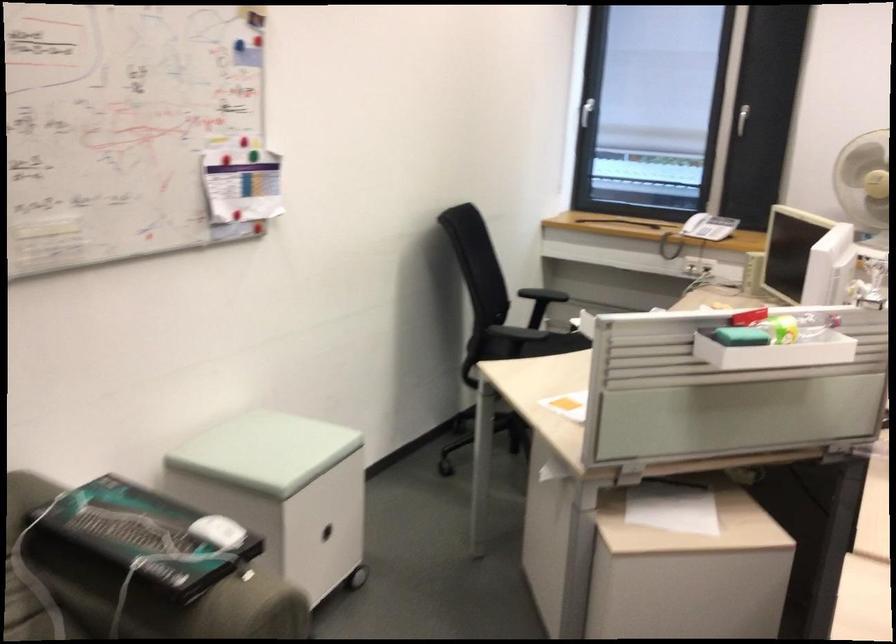
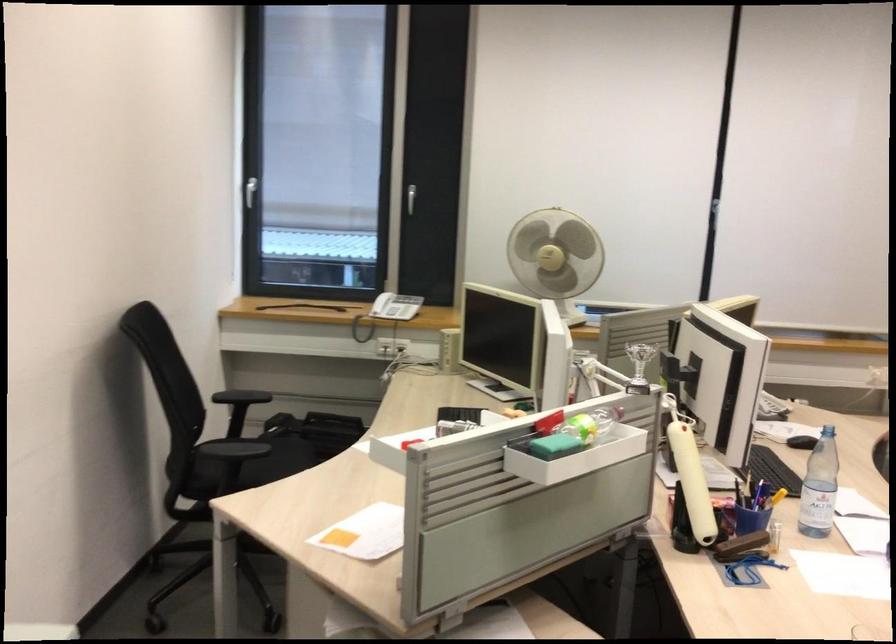
Find the pixel in the second image that matches the point at 745,330 in the first image.

(554, 446)